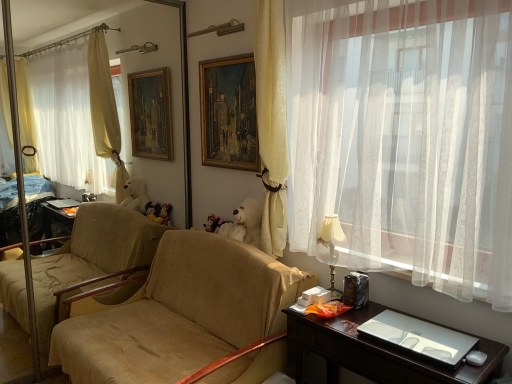
I want to click on free space above wooden oil painting at center (from a real-world perspective), so click(x=236, y=54).